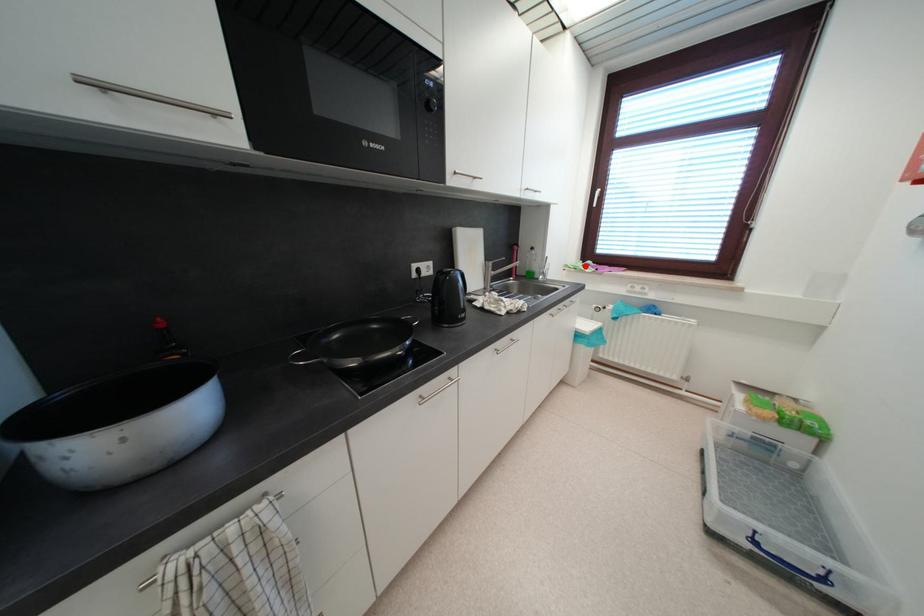
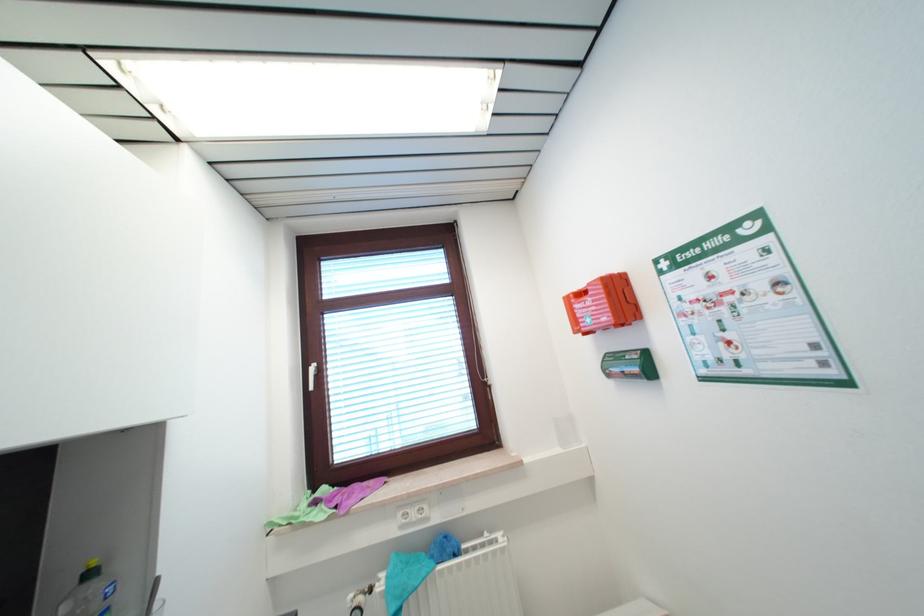
Locate, in the second image, the point that corresponds to the highlighted location in the first image.

(311, 501)